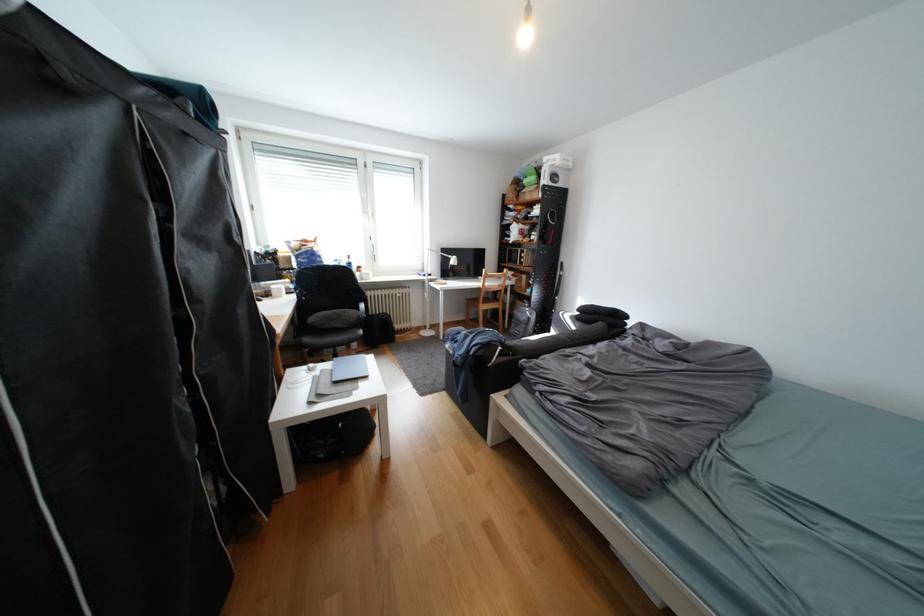
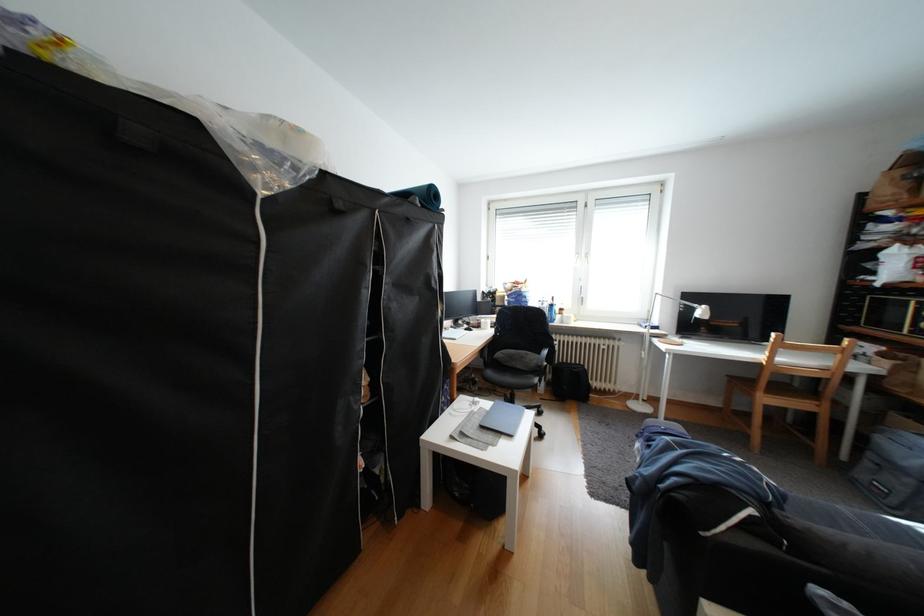
In the second image, find the point that corresponds to pixel 79 76 in the first image.

(351, 206)